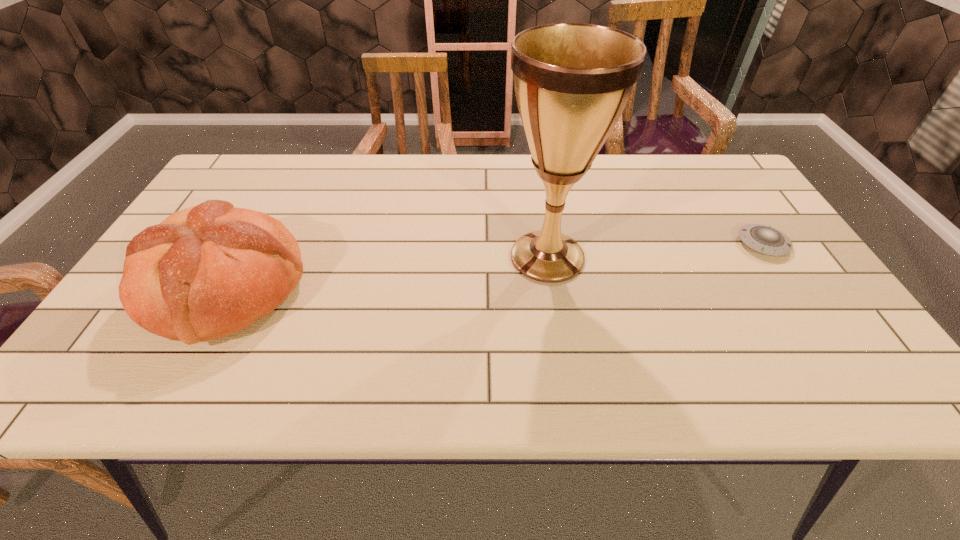
You are a GUI agent. You are given a task and a screenshot of the screen. Output one action in this format:
    pyautogui.click(x=<x>, y=<y>)
    Task: Click on the tallest object
    Image resolution: width=960 pixels, height=540 pixels.
    Given the screenshot: What is the action you would take?
    pyautogui.click(x=572, y=81)

The height and width of the screenshot is (540, 960). Identify the location of the second object from left to right. (572, 81).

What are the coordinates of `bread` in the screenshot? It's located at (208, 271).

The image size is (960, 540). Find the location of `the leftmost object`. the leftmost object is located at coordinates (208, 271).

Identify the location of the shortest object. (764, 239).

The height and width of the screenshot is (540, 960). Identify the location of the rightmost object. (764, 239).

In order to click on blank area located 0.060m on the front of the tallest object in this screenshot , I will do tap(556, 311).

Identify the location of vacant space located 0.100m on the right of the bread. This screenshot has width=960, height=540. (350, 288).

You are a GUI agent. You are given a task and a screenshot of the screen. Output one action in this format:
    pyautogui.click(x=<x>, y=<y>)
    Task: Click on the vacant space located 0.310m on the left of the shortest object
    
    Given the screenshot: What is the action you would take?
    pyautogui.click(x=617, y=244)

The image size is (960, 540). I want to click on object that is at the left edge, so click(208, 271).